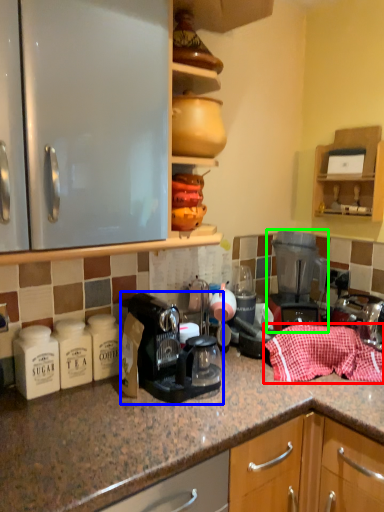
Question: Estimate the real-world distances between objects in this image. Which object is closer to material (highlighted by a red box), coffee machine (highlighted by a blue box) or home appliance (highlighted by a green box)?

Choices:
 (A) coffee machine
 (B) home appliance

Answer: (B)